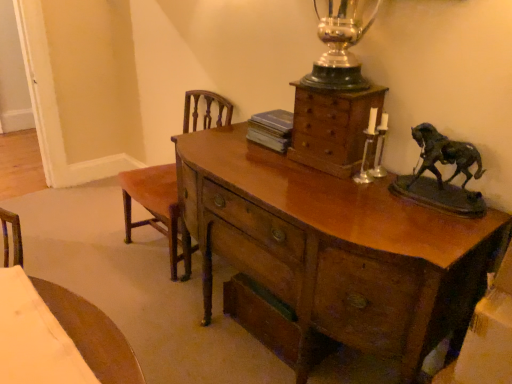
Locate an element on the screen. free space in front of wooden chest of drawers at upper center is located at coordinates (336, 193).